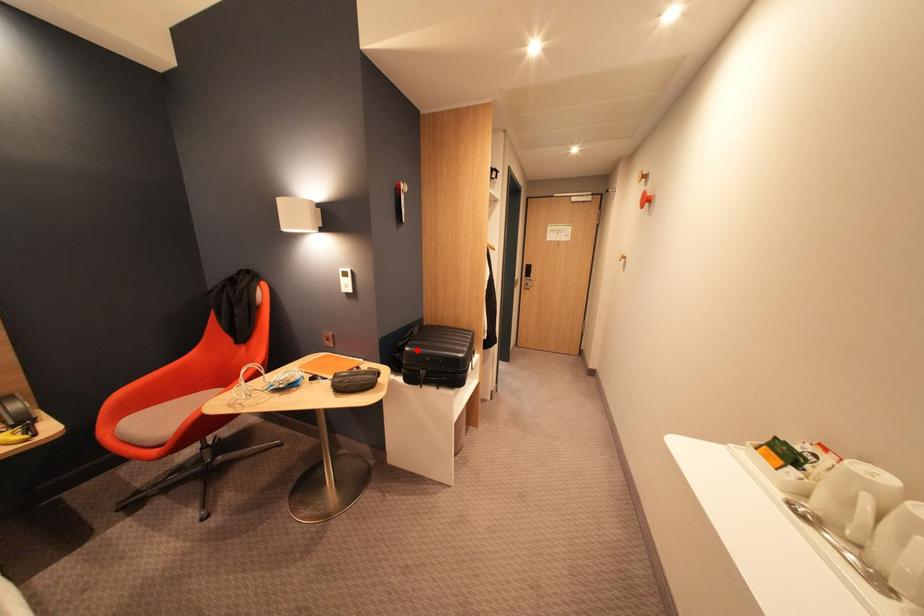
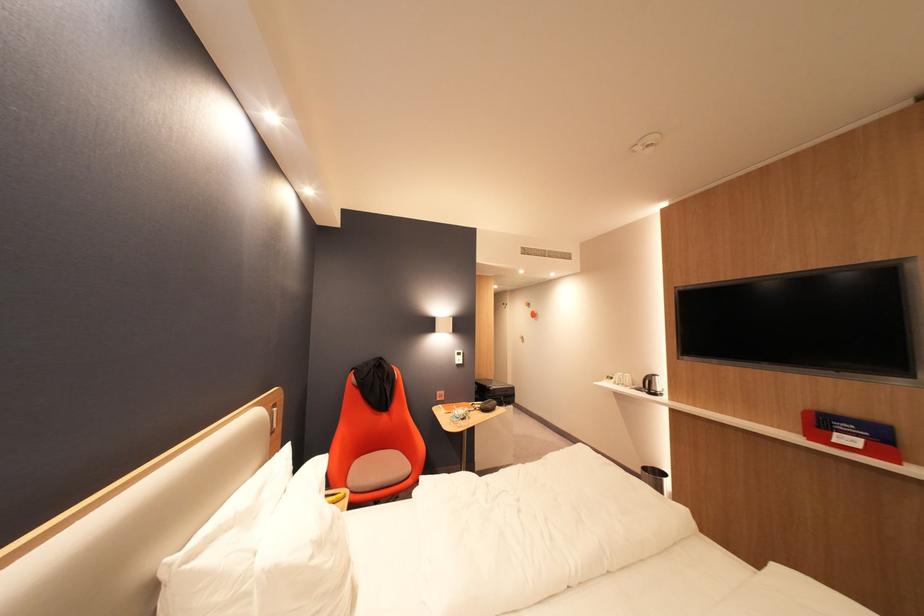
Locate, in the second image, the point that corresponds to the highlighted location in the first image.

(502, 390)